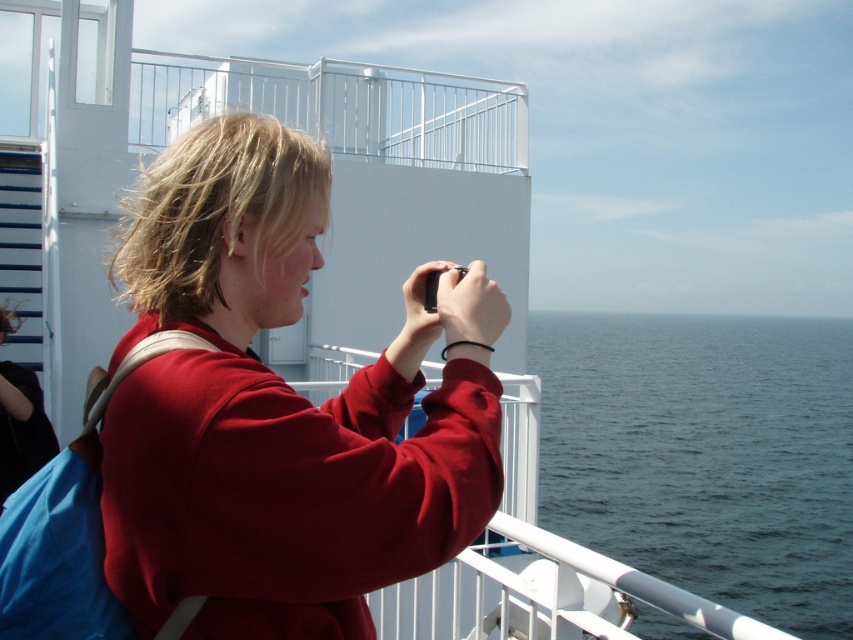
Question: Among these objects, which one is nearest to the camera?

Choices:
 (A) white metal railing at upper center
 (B) matte black jacket at left

Answer: (B)

Question: Does white metal railing at upper center come in front of matte black jacket at left?

Choices:
 (A) yes
 (B) no

Answer: (B)

Question: Observing the image, what is the correct spatial positioning of matte red sweatshirt at center in reference to blue water at right?

Choices:
 (A) below
 (B) above

Answer: (B)

Question: Can you confirm if matte red sweatshirt at center is positioned above blue water at right?

Choices:
 (A) no
 (B) yes

Answer: (B)

Question: Which of the following is the farthest from the observer?

Choices:
 (A) (16, 376)
 (B) (489, 144)
 (C) (368, 580)

Answer: (B)

Question: Which of the following is the farthest from the observer?

Choices:
 (A) (274, 160)
 (B) (480, 77)

Answer: (B)